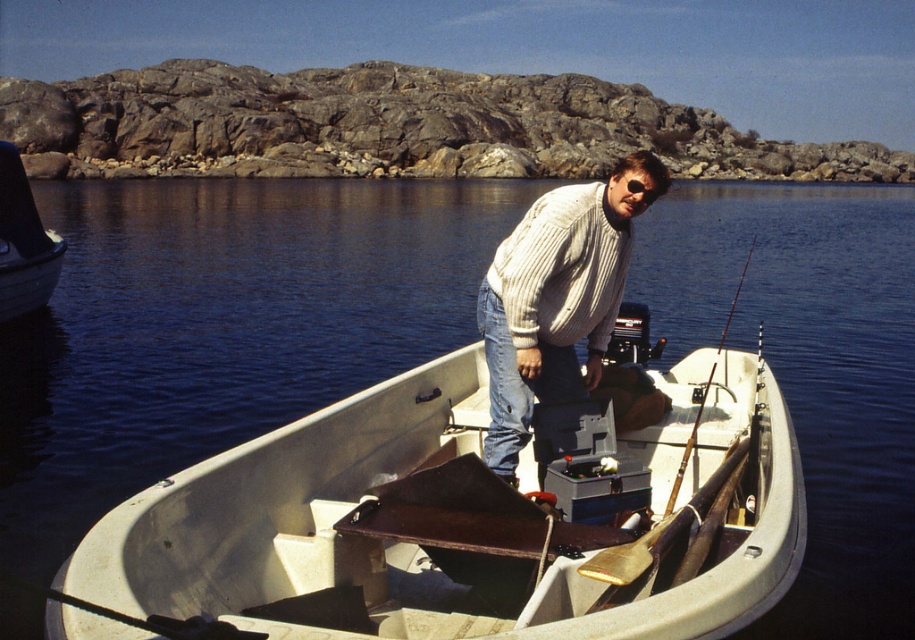
Between white knitted sweater at center and metallic gray boat at left, which one is positioned lower?

Positioned lower is white knitted sweater at center.

Does white knitted sweater at center appear over metallic gray boat at left?

Actually, white knitted sweater at center is below metallic gray boat at left.

Where is `white knitted sweater at center`? This screenshot has width=915, height=640. white knitted sweater at center is located at coordinates (557, 298).

Does white plastic boat at center appear under metallic gray boat at left?

Yes.

Between white plastic boat at center and metallic gray boat at left, which one appears on the left side from the viewer's perspective?

metallic gray boat at left is more to the left.

In order to click on white plastic boat at center in this screenshot , I will do `click(461, 522)`.

Which is more to the right, white plastic boat at center or white knitted sweater at center?

white knitted sweater at center is more to the right.

Measure the distance between point (393, 435) and camera.

Point (393, 435) and camera are 7.92 meters apart.

Where is `white plastic boat at center`? This screenshot has height=640, width=915. white plastic boat at center is located at coordinates (461, 522).